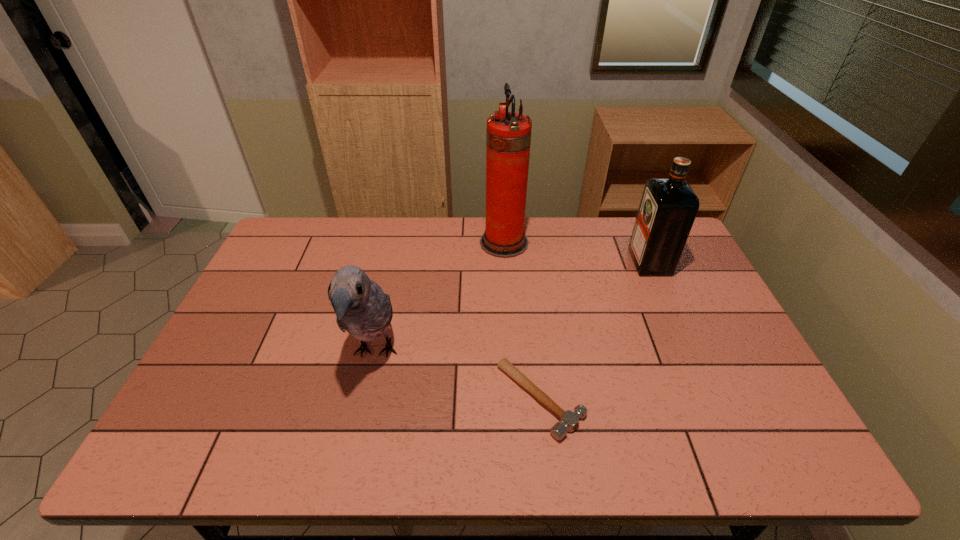
At what (x,y) coordinates should I click in order to perform the action: click on fire extinguisher. Please return your answer as a coordinate pair (x, y). Looking at the image, I should click on (508, 137).

Where is `liquor`? The image size is (960, 540). liquor is located at coordinates (668, 207).

Where is `the leftmost object`? The width and height of the screenshot is (960, 540). the leftmost object is located at coordinates (362, 308).

Locate an element on the screen. hammer is located at coordinates (569, 421).

I want to click on free space located at the discharge end of the fire extinguisher, so click(x=376, y=242).

You are a GUI agent. You are given a task and a screenshot of the screen. Output one action in this format:
    pyautogui.click(x=<x>, y=<y>)
    Task: Click on the free space located at the discharge end of the fire extinguisher
    The image size is (960, 540).
    Given the screenshot: What is the action you would take?
    pyautogui.click(x=365, y=242)

This screenshot has height=540, width=960. I want to click on vacant space located at the discharge end of the fire extinguisher, so pyautogui.click(x=466, y=242).

Find the location of a particular element. The width and height of the screenshot is (960, 540). free region located on the front label of the rightmost object is located at coordinates (569, 262).

Locate an element on the screen. Image resolution: width=960 pixels, height=540 pixels. free region located on the front label of the rightmost object is located at coordinates coord(588,262).

Image resolution: width=960 pixels, height=540 pixels. Identify the location of vacant space situated 0.260m on the front label of the rightmost object. (554, 262).